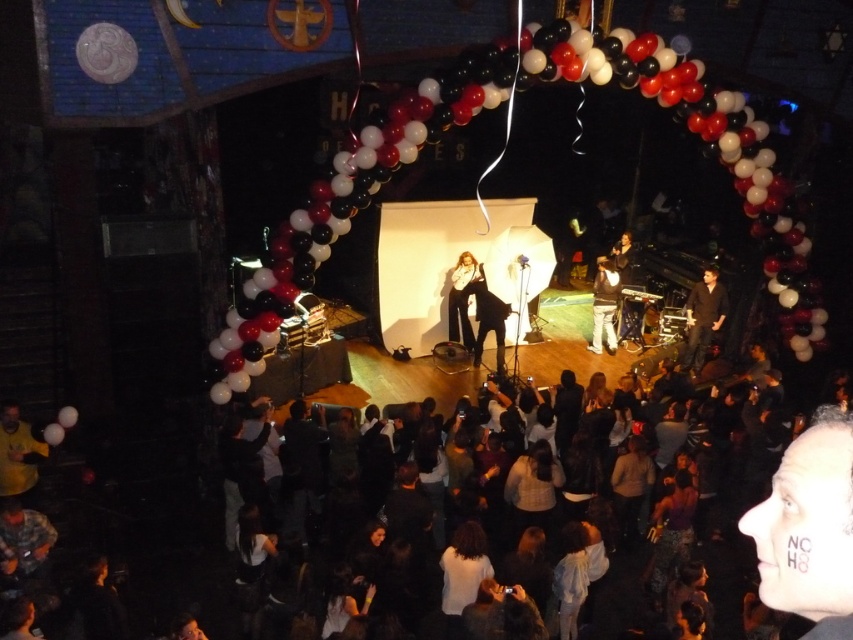
Can you confirm if dark clothing crowd at center is thinner than white leather jacket at center?

Yes, dark clothing crowd at center is thinner than white leather jacket at center.

Find the location of a particular element. dark clothing crowd at center is located at coordinates (148, 550).

Which of these two, red and white balloons at center or dark brown leather jacket at right, stands shorter?

red and white balloons at center is shorter.

Consider the image. Can you confirm if red and white balloons at center is shorter than dark brown leather jacket at right?

Yes.

Is point (801, 360) positioned before point (701, 336)?

No, it is not.

The width and height of the screenshot is (853, 640). What are the coordinates of `red and white balloons at center` in the screenshot? It's located at (500, 157).

Is point (490, 307) positioned in front of point (451, 307)?

Yes.

Can you confirm if black leather pants at center is smaller than white leather jacket at center?

Incorrect, black leather pants at center is not smaller in size than white leather jacket at center.

What do you see at coordinates (474, 310) in the screenshot? I see `black leather pants at center` at bounding box center [474, 310].

At what (x,y) coordinates should I click in order to perform the action: click on black leather pants at center. Please return your answer as a coordinate pair (x, y). This screenshot has width=853, height=640. Looking at the image, I should click on (474, 310).